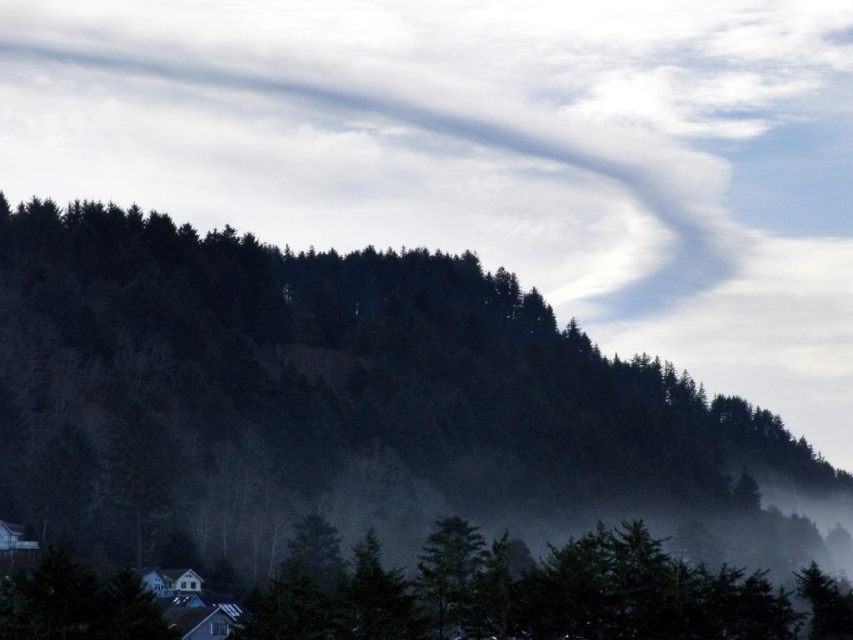
Which of these two, green matte trees at center or green matte tree at lower center, stands taller?

Standing taller between the two is green matte trees at center.

Between point (257, 248) and point (428, 540), which one is positioned in front?

Point (428, 540) is in front.

Between point (178, 282) and point (460, 582), which one is positioned behind?

The point (178, 282) is more distant.

You are a GUI agent. You are given a task and a screenshot of the screen. Output one action in this format:
    pyautogui.click(x=<x>, y=<y>)
    Task: Click on the green matte trees at center
    The width and height of the screenshot is (853, 640).
    Given the screenshot: What is the action you would take?
    pyautogui.click(x=352, y=404)